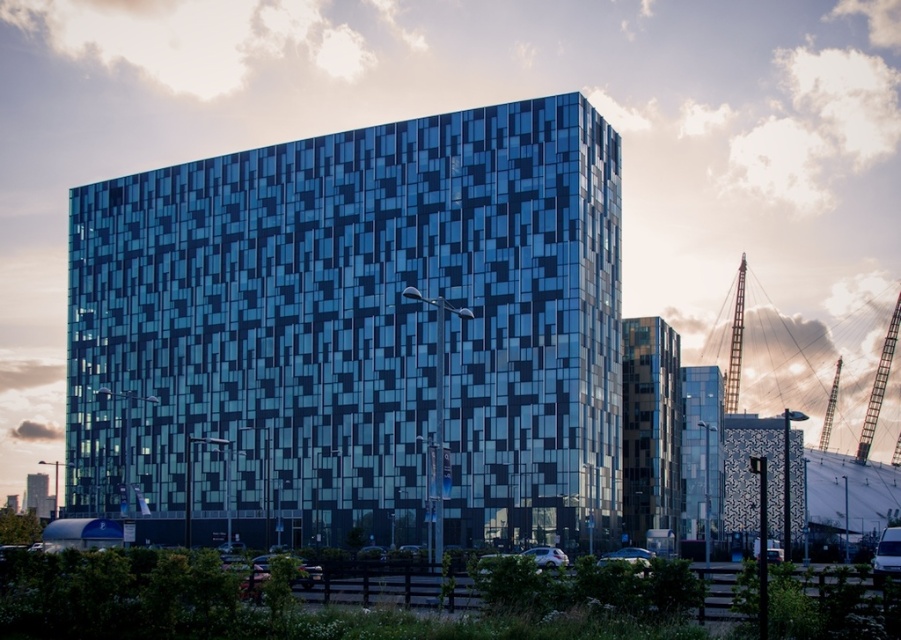
Question: Which of the following is the closest to the observer?

Choices:
 (A) click(639, 552)
 (B) click(797, 364)

Answer: (A)

Question: Is blue glass building at center bigger than metallic silver crane at upper right?

Choices:
 (A) no
 (B) yes

Answer: (B)

Question: Can you confirm if blue glass building at center is positioned to the left of metallic silver car at lower center?

Choices:
 (A) yes
 (B) no

Answer: (A)

Question: Which point is farther to the camera?

Choices:
 (A) (578, 314)
 (B) (551, 563)
 (C) (713, 448)
 (D) (629, 536)

Answer: (C)

Question: Can you confirm if metallic silver crane at upper right is positioned below shiny silver car at lower center?

Choices:
 (A) yes
 (B) no

Answer: (B)

Question: Which is nearer to the transparent glass tower at center?

Choices:
 (A) shiny silver car at lower center
 (B) metallic silver crane at upper right
 (C) blue glass building at center

Answer: (A)